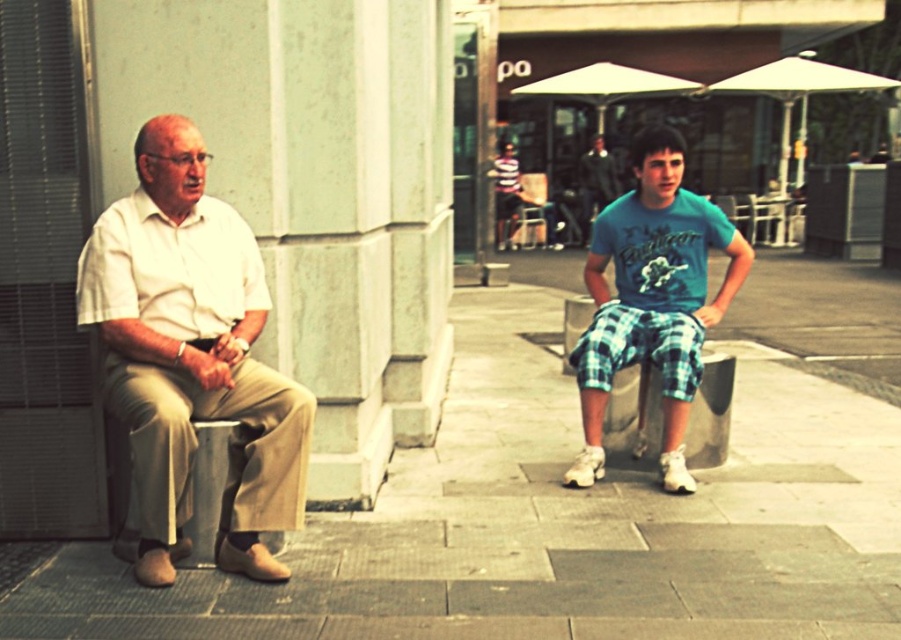
Is smooth concrete pavement at center bigger than white cotton shirt at left?

Incorrect, smooth concrete pavement at center is not larger than white cotton shirt at left.

Who is more distant from viewer, (443,424) or (201,364)?

The point (443,424) is more distant.

The image size is (901, 640). In order to click on smooth concrete pavement at center in this screenshot , I will do `click(552, 525)`.

Does point (167, 314) come in front of point (623, 273)?

Yes, it is in front of point (623, 273).

Is white cotton shirt at left wider than green plaid shorts at center?

Incorrect, white cotton shirt at left's width does not surpass green plaid shorts at center's.

Which is in front, point (106, 356) or point (583, 380)?

Point (106, 356) is more forward.

At what (x,y) coordinates should I click in order to perform the action: click on white cotton shirt at left. Please return your answer as a coordinate pair (x, y). The width and height of the screenshot is (901, 640). Looking at the image, I should click on (190, 356).

Who is shorter, smooth concrete pavement at center or green plaid shorts at center?

Standing shorter between the two is smooth concrete pavement at center.

Is point (358, 538) closer to viewer compared to point (660, 145)?

Yes, it is in front of point (660, 145).

Find the location of `smooth concrete pavement at center`. smooth concrete pavement at center is located at coordinates (552, 525).